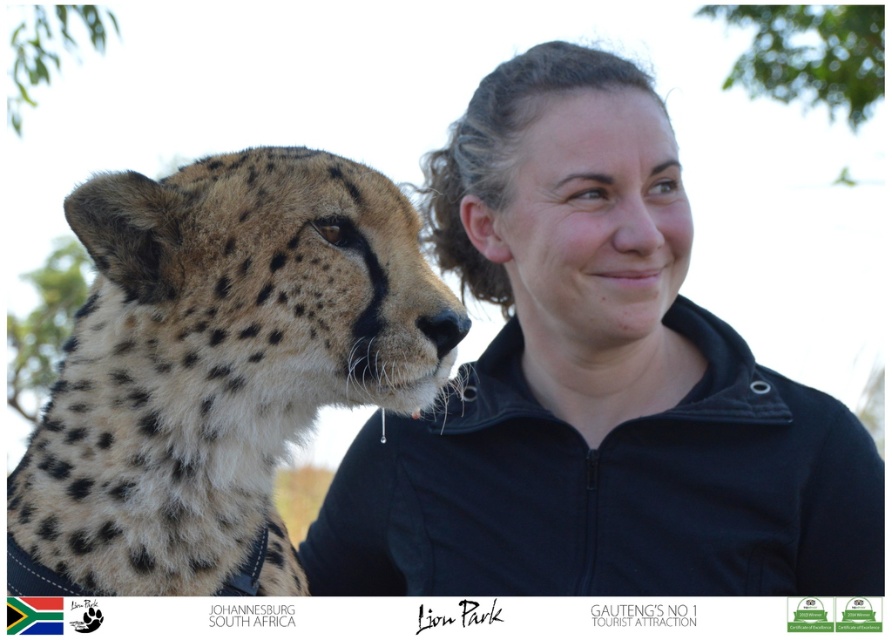
You are a photographer trying to capture a photo of the spotted fur cheetah at left and the matte black jacket at center. Since you want both subjects to be in focus, which part of the image should you adjust the focus on first?

The matte black jacket at center is much taller than the spotted fur cheetah at left. To ensure both are in focus, focus on the matte black jacket at center first because it is taller and might be further away, requiring precise focus adjustment.

Looking at this image, you are a photographer trying to capture a photo of the spotted fur cheetah at left and the matte black jacket at center. Which object is wider in the frame?

The matte black jacket at center might be wider than spotted fur cheetah at left according to the description.